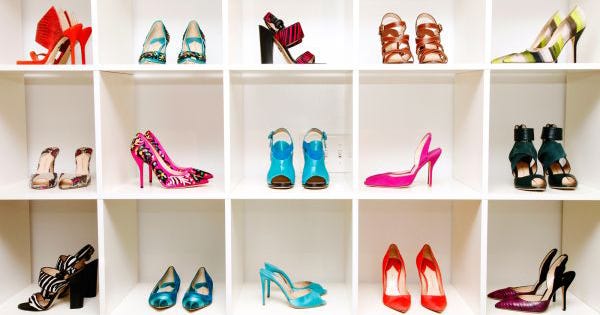
I want to click on shoes on lower shelf, so click(x=523, y=302), click(x=511, y=294), click(x=436, y=303), click(x=393, y=303), click(x=311, y=303), click(x=312, y=288), click(x=195, y=299), click(x=166, y=301), click(x=34, y=301), click(x=62, y=262).